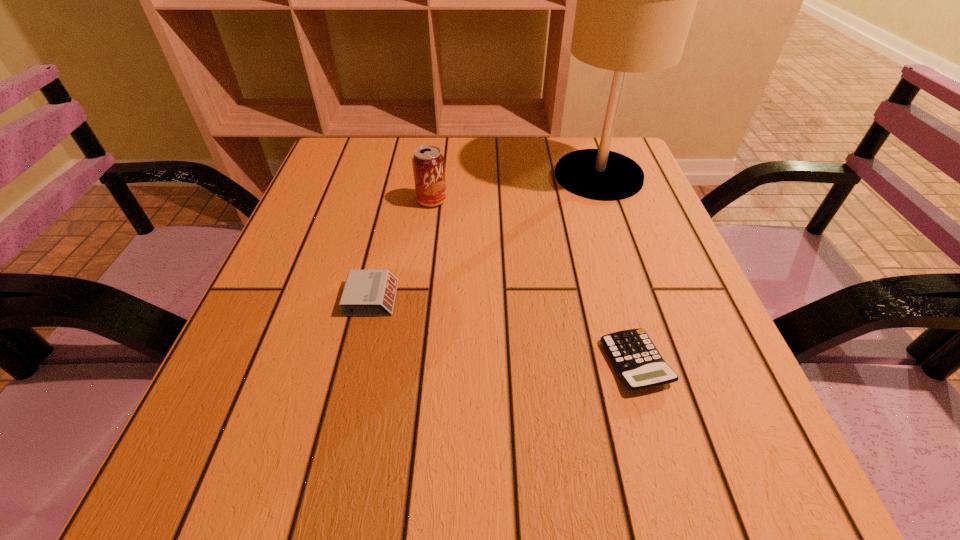
Image resolution: width=960 pixels, height=540 pixels. What are the coordinates of `vacant space located 0.080m on the front of the nearest object` in the screenshot? It's located at (661, 451).

Find the location of `object situated at the far edge`. object situated at the far edge is located at coordinates (635, 0).

This screenshot has width=960, height=540. In order to click on object located in the left edge section of the desktop in this screenshot , I will do (366, 292).

Locate an element on the screen. table lamp present at the right edge is located at coordinates (635, 0).

Find the location of a particular element. calculator situated at the right edge is located at coordinates (637, 361).

Where is `object that is at the far right corner`? The height and width of the screenshot is (540, 960). object that is at the far right corner is located at coordinates (635, 0).

In the image, there is a desktop. Where is `vacant space at the far edge`? The width and height of the screenshot is (960, 540). vacant space at the far edge is located at coordinates (480, 169).

Locate an element on the screen. vacant region at the near edge of the desktop is located at coordinates (536, 456).

The width and height of the screenshot is (960, 540). Identify the location of vacant space at the left edge of the desktop. (291, 361).

Where is `free spot at the right edge of the desktop`? free spot at the right edge of the desktop is located at coordinates (604, 256).